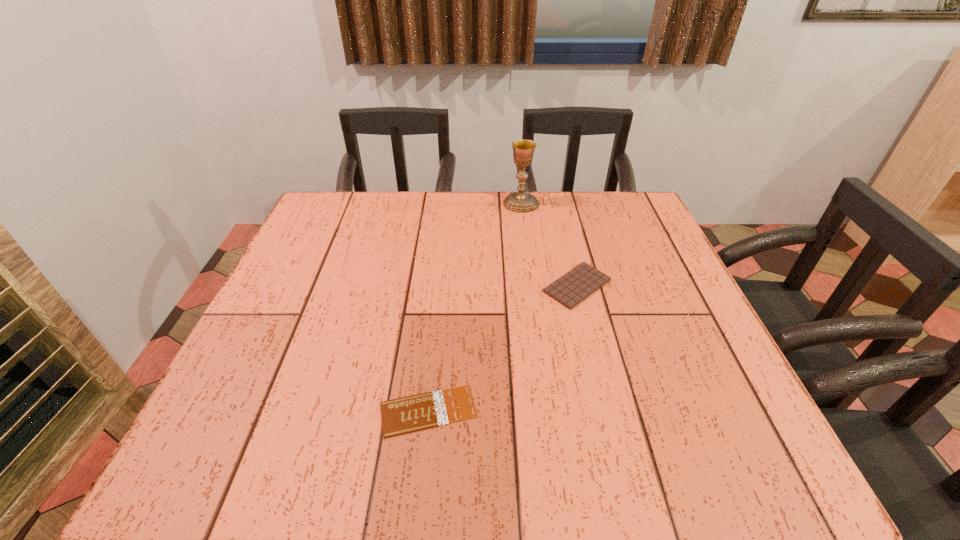
In order to click on the tallest object in this screenshot , I will do `click(523, 150)`.

At what (x,y) coordinates should I click in order to perform the action: click on chalice. Please return your answer as a coordinate pair (x, y). Looking at the image, I should click on (523, 150).

Image resolution: width=960 pixels, height=540 pixels. What are the coordinates of `the second farthest object` in the screenshot? It's located at (575, 286).

Identify the location of the right chocolate bar. (575, 286).

Locate an element on the screen. This screenshot has width=960, height=540. the nearer chocolate bar is located at coordinates (418, 412).

Find the location of a particular element. the leftmost object is located at coordinates (418, 412).

You are a GUI agent. You are given a task and a screenshot of the screen. Output one action in this format:
    pyautogui.click(x=<x>, y=<y>)
    Task: Click on the free spot located on the right of the farthest object
    
    Given the screenshot: What is the action you would take?
    pyautogui.click(x=627, y=203)

Where is `vacant region located 0.330m on the left of the taller chocolate bar`? This screenshot has height=540, width=960. vacant region located 0.330m on the left of the taller chocolate bar is located at coordinates (395, 286).

At what (x,y) coordinates should I click in order to perform the action: click on vacant space positioned 0.290m on the back of the leftmost object. Please return your answer as a coordinate pair (x, y). The height and width of the screenshot is (540, 960). Looking at the image, I should click on (442, 279).

The width and height of the screenshot is (960, 540). What are the coordinates of `object located at the far edge` in the screenshot? It's located at (523, 150).